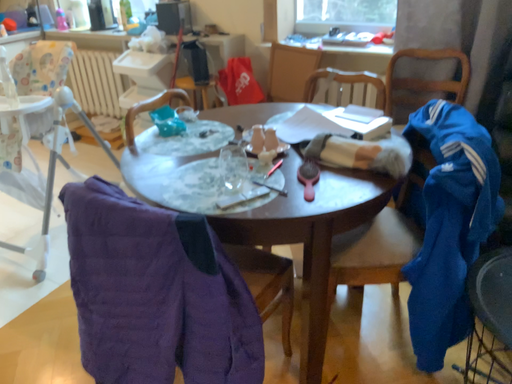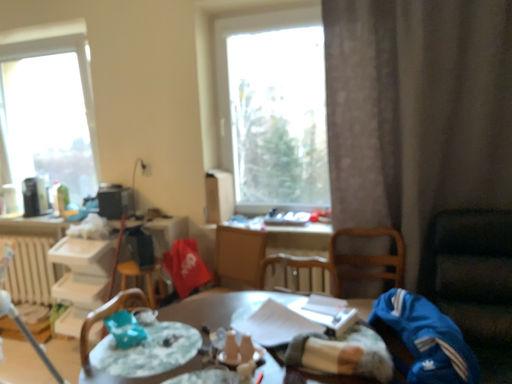
Question: How did the camera likely rotate when shooting the video?

Choices:
 (A) rotated left
 (B) rotated right

Answer: (B)